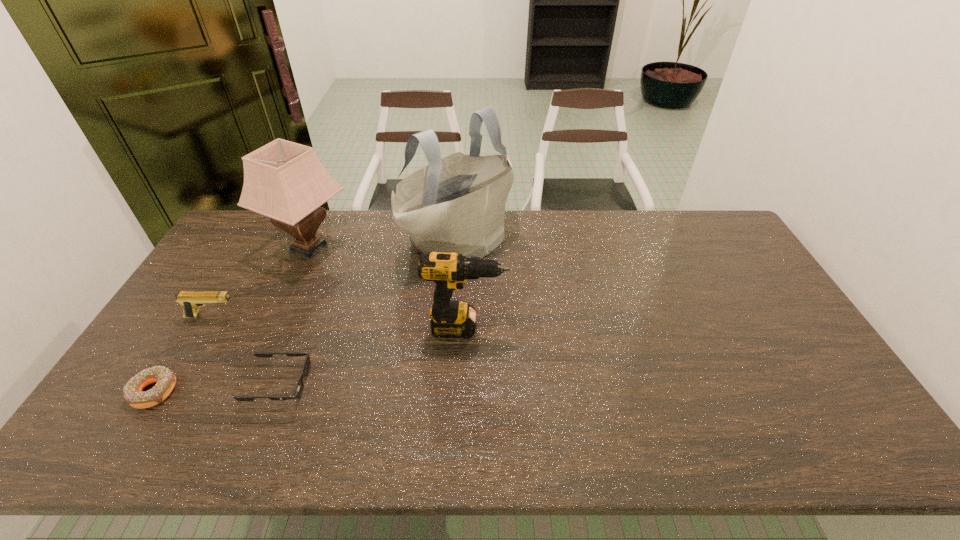
The height and width of the screenshot is (540, 960). Find the location of `vacant region at the left edge`. vacant region at the left edge is located at coordinates (207, 340).

In the image, there is a desktop. Identify the location of free space at the far right corner. The height and width of the screenshot is (540, 960). (719, 233).

Find the location of a particular element. vacant point located between the pistol and the sunglasses is located at coordinates (246, 350).

Image resolution: width=960 pixels, height=540 pixels. I want to click on vacant region between the sunglasses and the tallest object, so click(x=369, y=312).

Find the location of a particular element. free spot between the doughnut and the lampshade is located at coordinates (231, 319).

You are a GUI agent. You are given a task and a screenshot of the screen. Output one action in this format:
    pyautogui.click(x=<x>, y=<y>)
    Task: Click on the vacant space that is in between the lampshade and the fourth shortest object
    The width and height of the screenshot is (960, 540).
    Given the screenshot: What is the action you would take?
    pyautogui.click(x=387, y=287)

Image resolution: width=960 pixels, height=540 pixels. I want to click on unoccupied area between the shopping bag and the doughnut, so click(306, 316).

You are a GUI agent. You are given a task and a screenshot of the screen. Output one action in this format:
    pyautogui.click(x=<x>, y=<y>)
    Task: Click on the free space that is in between the doughnut and the fourth tallest object
    Image resolution: width=960 pixels, height=540 pixels.
    Given the screenshot: What is the action you would take?
    pyautogui.click(x=183, y=354)

Image resolution: width=960 pixels, height=540 pixels. Find the location of `free space that is in between the sunglasses and the lampshade`. free space that is in between the sunglasses and the lampshade is located at coordinates (294, 315).

The height and width of the screenshot is (540, 960). What are the coordinates of `free space between the doughnut and the pistol` in the screenshot? It's located at (183, 354).